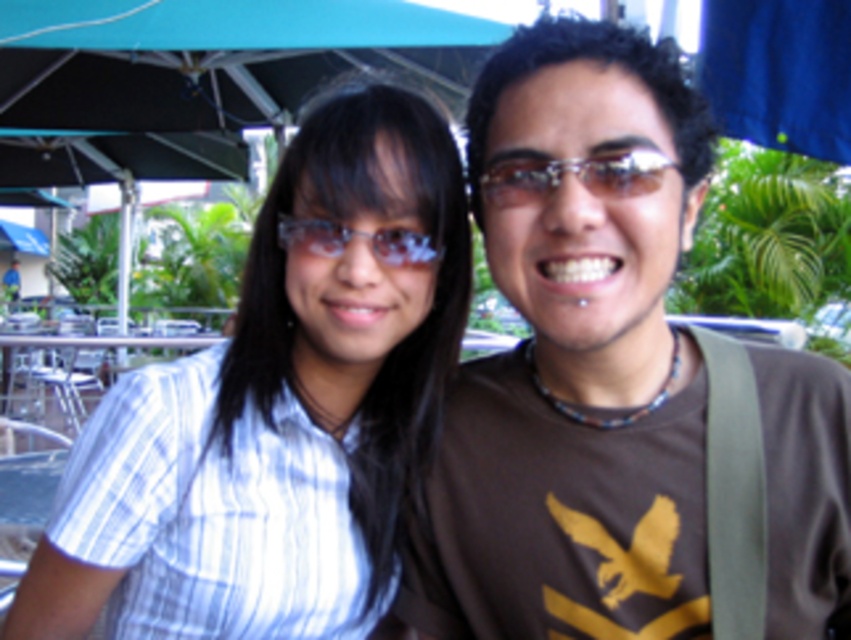
Which is behind, point (310, 144) or point (393, 232)?

The point (310, 144) is behind.

Locate an element on the screen. white striped shirt at center is located at coordinates (277, 413).

The height and width of the screenshot is (640, 851). Describe the element at coordinates (277, 413) in the screenshot. I see `white striped shirt at center` at that location.

Does point (357, 147) come closer to viewer compared to point (664, 156)?

No, it is not.

Who is more forward, (346, 449) or (566, 163)?

Point (566, 163) is in front.

Locate an element on the screen. white striped shirt at center is located at coordinates 277,413.

Does sunglasses at center have a lesser width compared to transparent plastic glasses at center?

Indeed, sunglasses at center has a lesser width compared to transparent plastic glasses at center.

Is point (609, 152) closer to camera compared to point (317, 243)?

That is True.

Where is `sunglasses at center`? This screenshot has width=851, height=640. sunglasses at center is located at coordinates (575, 176).